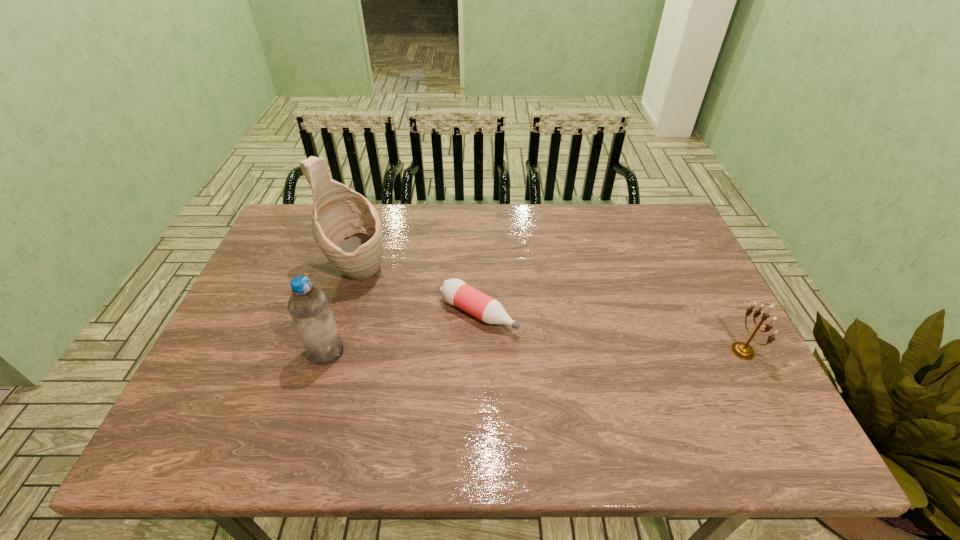
Identify the location of free space between the second tallest object and the tallest object. This screenshot has height=540, width=960. (342, 312).

Locate an element on the screen. The height and width of the screenshot is (540, 960). free point between the second tallest object and the candelabrum is located at coordinates (535, 352).

This screenshot has height=540, width=960. I want to click on vacant space that is in between the bottle and the water bottle, so click(402, 332).

This screenshot has width=960, height=540. In order to click on vacant space that is in between the shortest object and the water bottle in this screenshot , I will do `click(402, 332)`.

What are the coordinates of `blank region between the second tallest object and the pitcher` in the screenshot? It's located at (342, 312).

Where is `free space between the shortest object and the rightmost object`? This screenshot has width=960, height=540. free space between the shortest object and the rightmost object is located at coordinates (611, 332).

This screenshot has width=960, height=540. I want to click on free spot between the shortest object and the tallest object, so click(x=418, y=293).

Find the location of `blank region between the second shortest object and the shortest object`. blank region between the second shortest object and the shortest object is located at coordinates (611, 332).

Where is `vacant space that's between the pitcher and the third object from left to right`? vacant space that's between the pitcher and the third object from left to right is located at coordinates (418, 293).

You are a GUI agent. You are given a task and a screenshot of the screen. Output one action in this format:
    pyautogui.click(x=<x>, y=<y>)
    Task: Click on the empty location between the tallest object and the third shortest object
    The image size is (960, 540).
    Given the screenshot: What is the action you would take?
    pyautogui.click(x=342, y=312)